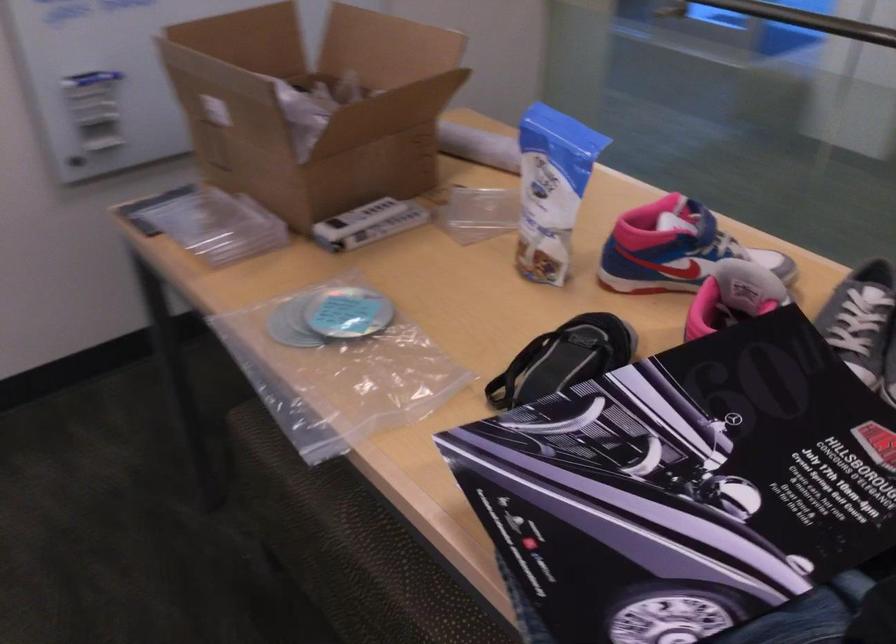
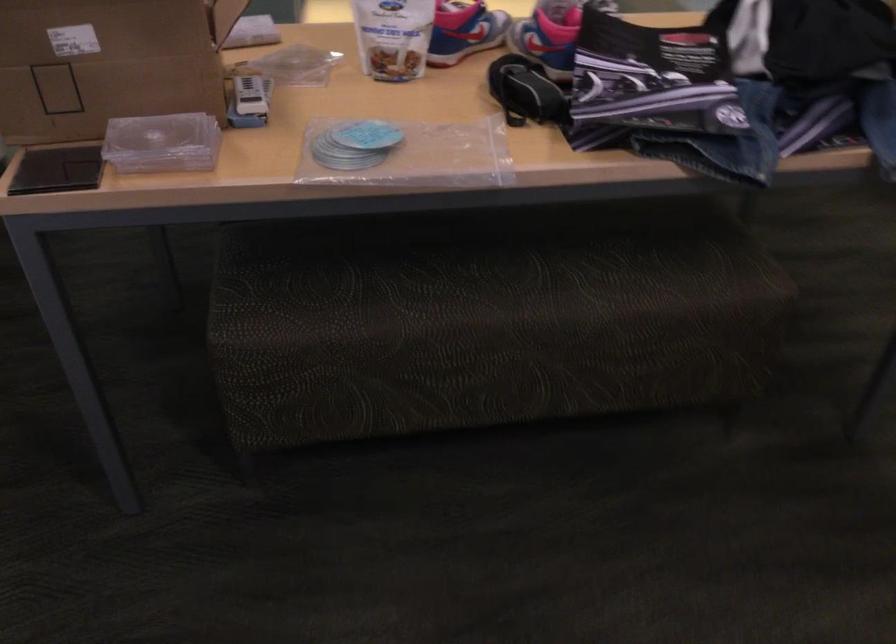
In the second image, find the point that corresponds to the point at 653,263 in the first image.

(463, 31)